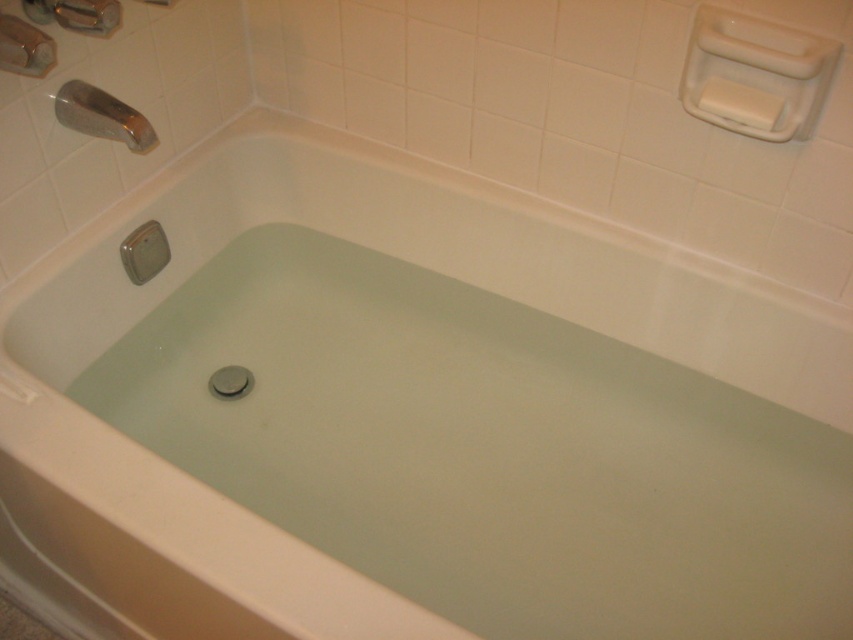
Is polished chrome faucet at upper left wider than white matte soap at upper right?

Yes.

Can you confirm if polished chrome faucet at upper left is taller than white matte soap at upper right?

Yes, polished chrome faucet at upper left is taller than white matte soap at upper right.

Is point (80, 83) farther from viewer compared to point (752, 125)?

Yes, it is.

The image size is (853, 640). Identify the location of polished chrome faucet at upper left. (102, 115).